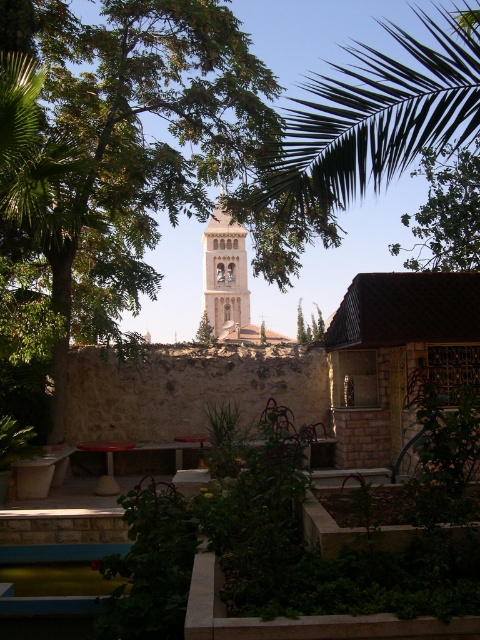
Between point (119, 1) and point (213, 291), which one is positioned behind?

Point (213, 291)

Which is above, green leafy tree at center or light beige stone bell tower at center?

Positioned higher is green leafy tree at center.

Is point (72, 276) closer to camera compared to point (219, 333)?

Yes, point (72, 276) is in front of point (219, 333).

Find the location of a particular element. Image resolution: width=480 pixels, height=640 pixels. green leafy tree at center is located at coordinates (132, 154).

Locate an element on the screen. The height and width of the screenshot is (640, 480). green leafy palm at upper center is located at coordinates (369, 122).

The image size is (480, 640). I want to click on green leafy palm at upper center, so click(x=369, y=122).

What are the coordinates of `green leafy palm at upper center` in the screenshot? It's located at click(x=369, y=122).

Which is in front, point (203, 113) or point (411, 172)?

Point (203, 113)

Can you confirm if green leafy tree at center is smaller than green leafy tree at upper right?

Yes, green leafy tree at center is smaller than green leafy tree at upper right.

Is point (47, 19) farther from camera compared to point (468, 218)?

No, it is not.

At what (x,y) coordinates should I click in order to perform the action: click on green leafy tree at center. Please return your answer as a coordinate pair (x, y). The height and width of the screenshot is (640, 480). Looking at the image, I should click on (132, 154).